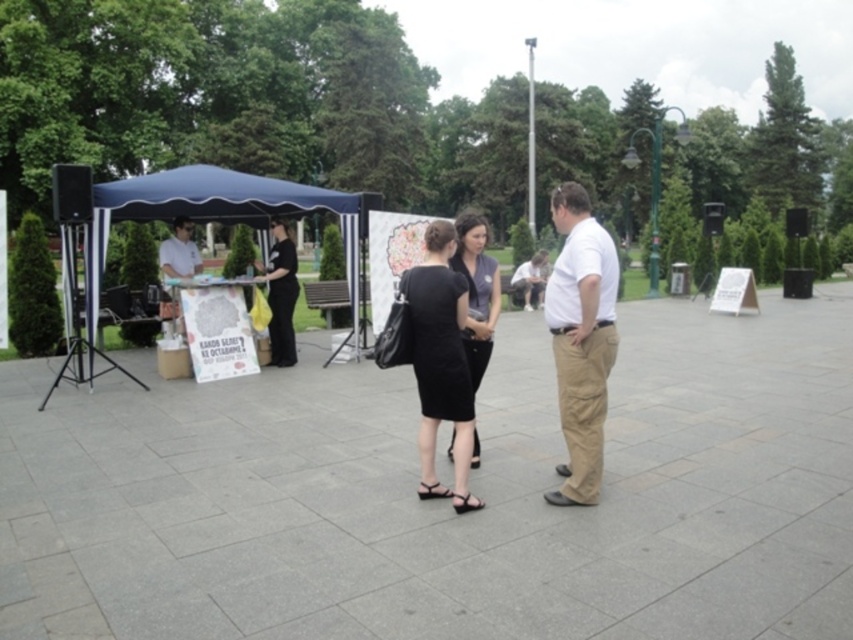
Question: Does black fabric dress at center come behind white shirt at center?

Choices:
 (A) yes
 (B) no

Answer: (B)

Question: Is black fabric umbrella at upper center to the right of white shirt at center from the viewer's perspective?

Choices:
 (A) no
 (B) yes

Answer: (B)

Question: Which of the following is the closest to the observer?

Choices:
 (A) blue fabric tent at left
 (B) white cotton shirt at center
 (C) white shirt at center
 (D) black fabric umbrella at upper center

Answer: (B)

Question: Which object is positioned farthest from the black fabric dress at center?

Choices:
 (A) black fabric umbrella at upper center
 (B) white shirt at center

Answer: (B)

Question: Is black matte dress at center closer to camera compared to black fabric dress at center?

Choices:
 (A) yes
 (B) no

Answer: (A)

Question: Which point is farther to the camera?

Choices:
 (A) (581, 358)
 (B) (474, 220)
 (C) (415, 268)

Answer: (B)